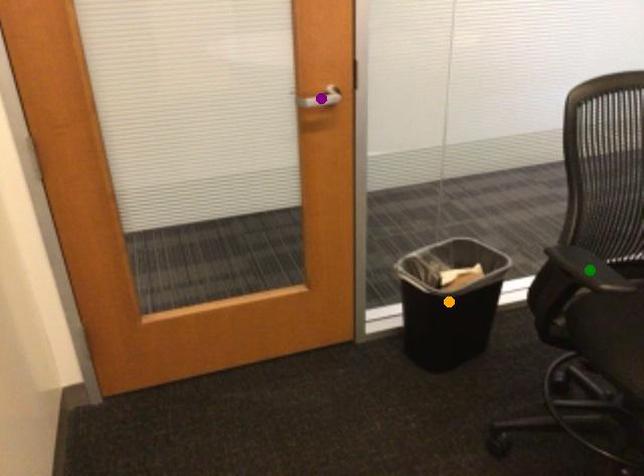
Order these from nearest to farthest:
purple point, orange point, green point

orange point < purple point < green point